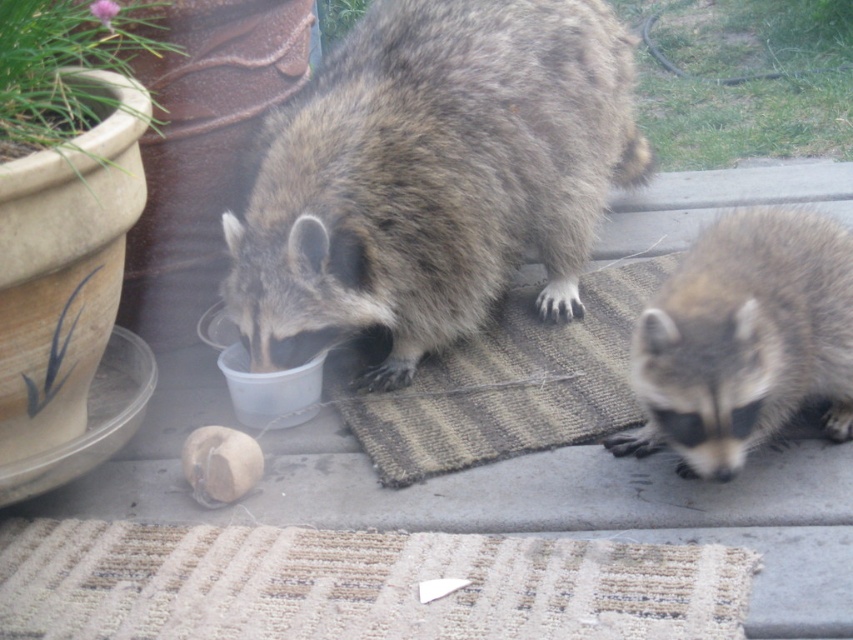
Between fuzzy brown raccoon at center and fuzzy brown raccoon at lower right, which one has less height?

fuzzy brown raccoon at lower right

You are a GUI agent. You are given a task and a screenshot of the screen. Output one action in this format:
    pyautogui.click(x=<x>, y=<y>)
    Task: Click on the fuzzy brown raccoon at center
    
    Given the screenshot: What is the action you would take?
    pyautogui.click(x=432, y=177)

Identify the location of fuzzy brown raccoon at center. This screenshot has height=640, width=853. (432, 177).